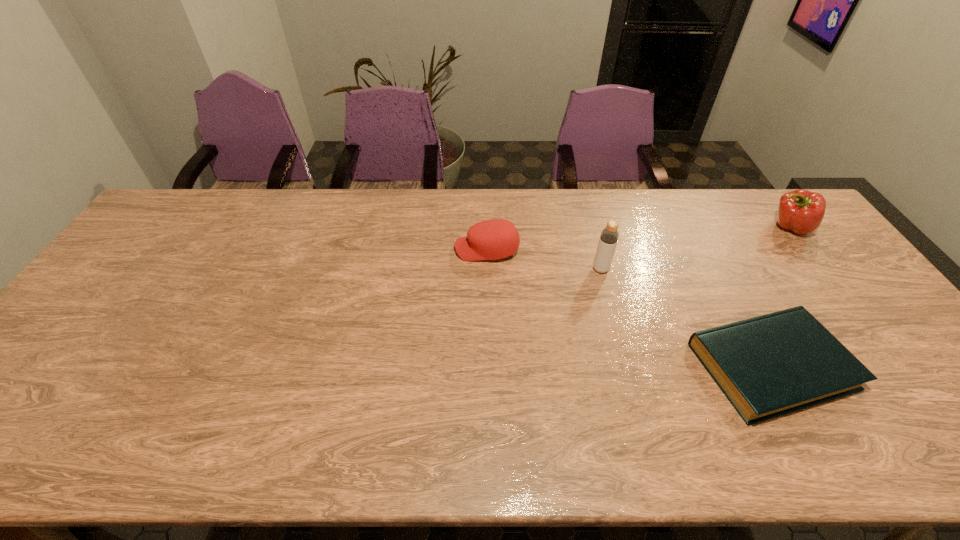
Locate an element on the screen. This screenshot has height=540, width=960. vacant area located 0.140m on the front-facing side of the cap is located at coordinates point(410,249).

Locate an element on the screen. This screenshot has width=960, height=540. vacant space situated on the front-facing side of the cap is located at coordinates [x=410, y=249].

You are a GUI agent. You are given a task and a screenshot of the screen. Output one action in this format:
    pyautogui.click(x=<x>, y=<y>)
    Task: Click on the free space located 0.370m on the front-facing side of the cap
    This screenshot has height=540, width=960.
    Given the screenshot: What is the action you would take?
    pyautogui.click(x=336, y=249)

This screenshot has height=540, width=960. I want to click on free region located 0.190m on the right of the shortest object, so click(925, 366).

The image size is (960, 540). In order to click on object that is at the far edge in this screenshot , I will do `click(801, 211)`.

This screenshot has height=540, width=960. Find the location of `object that is at the near edge`. object that is at the near edge is located at coordinates click(767, 366).

You are a GUI agent. You are given a task and a screenshot of the screen. Output one action in this format:
    pyautogui.click(x=<x>, y=<y>)
    Task: Click on the object that is at the right edge
    The height and width of the screenshot is (540, 960).
    Given the screenshot: What is the action you would take?
    pyautogui.click(x=801, y=211)

The width and height of the screenshot is (960, 540). I want to click on object that is at the far right corner, so click(x=801, y=211).

This screenshot has height=540, width=960. I want to click on free space at the far edge, so (681, 188).

Where is `free space at the near edge`? This screenshot has width=960, height=540. free space at the near edge is located at coordinates (540, 422).